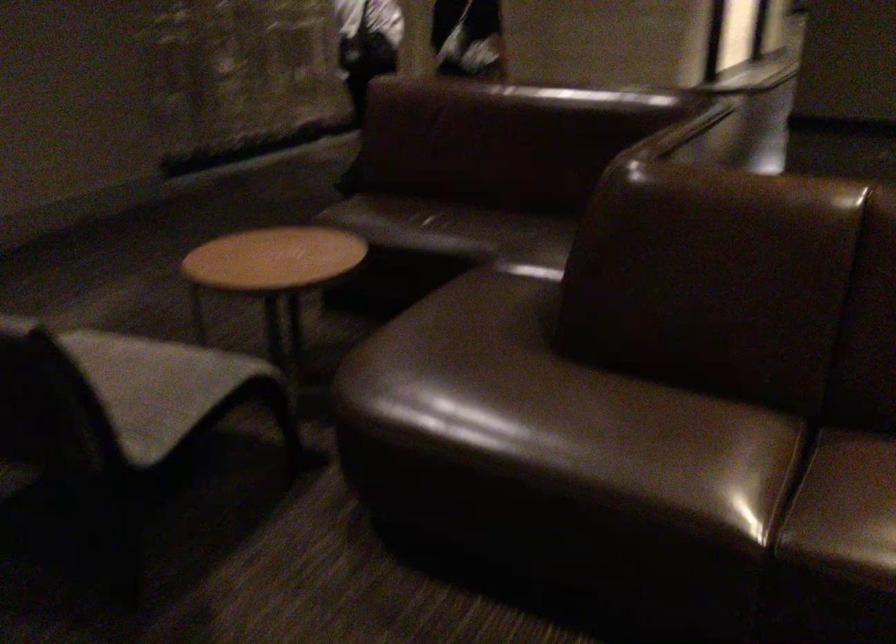
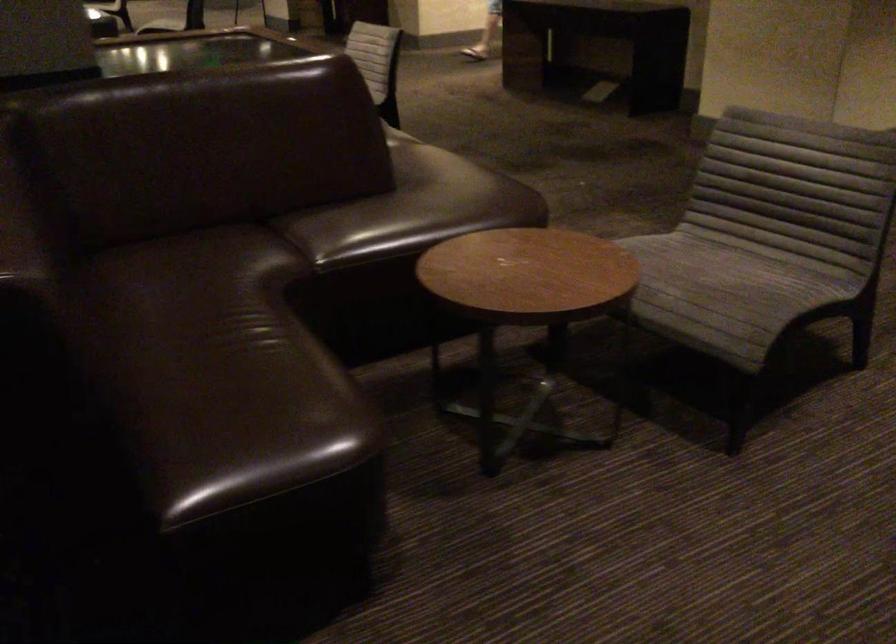
In the second image, find the point that corresponds to [392,196] in the first image.

(231, 399)